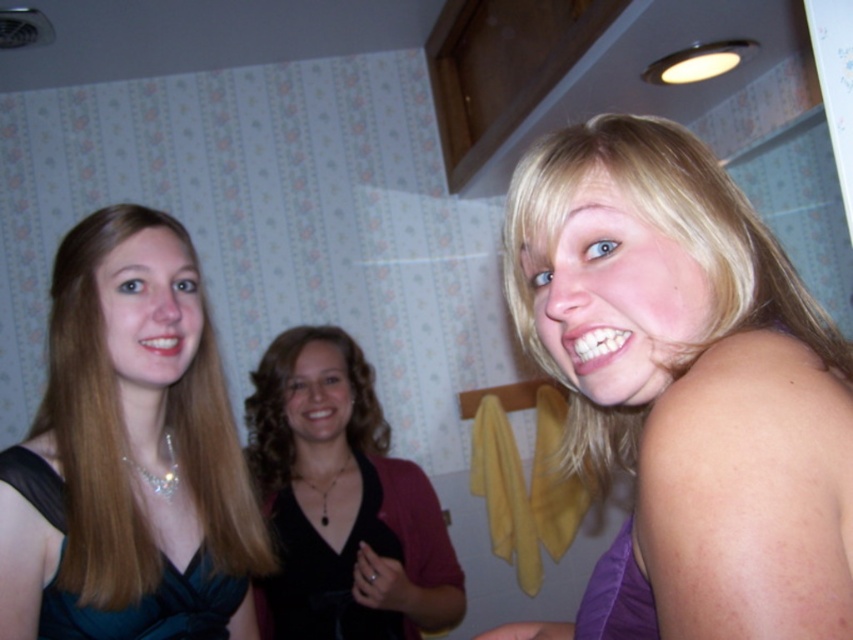
Is teal satin dress at left wider than black velvet blazer at center?

In fact, teal satin dress at left might be narrower than black velvet blazer at center.

From the picture: Does teal satin dress at left lie in front of black velvet blazer at center?

Yes.

Does point (57, 330) come farther from viewer compared to point (316, 509)?

No, it is not.

I want to click on teal satin dress at left, so click(129, 428).

The image size is (853, 640). Identify the location of teal satin dress at left. (129, 428).

Who is higher up, teal satin dress at left or satin black dress at left?

teal satin dress at left is above.

Image resolution: width=853 pixels, height=640 pixels. What do you see at coordinates (129, 428) in the screenshot?
I see `teal satin dress at left` at bounding box center [129, 428].

The width and height of the screenshot is (853, 640). What are the coordinates of `teal satin dress at left` in the screenshot? It's located at (129, 428).

Which is above, matte black dress at center or black satin dress at center?

matte black dress at center is above.

Does matte black dress at center have a greater height compared to black satin dress at center?

Yes, matte black dress at center is taller than black satin dress at center.

Does point (787, 275) lie behind point (277, 508)?

No, it is not.

Where is `matte black dress at center`? This screenshot has height=640, width=853. matte black dress at center is located at coordinates (665, 234).